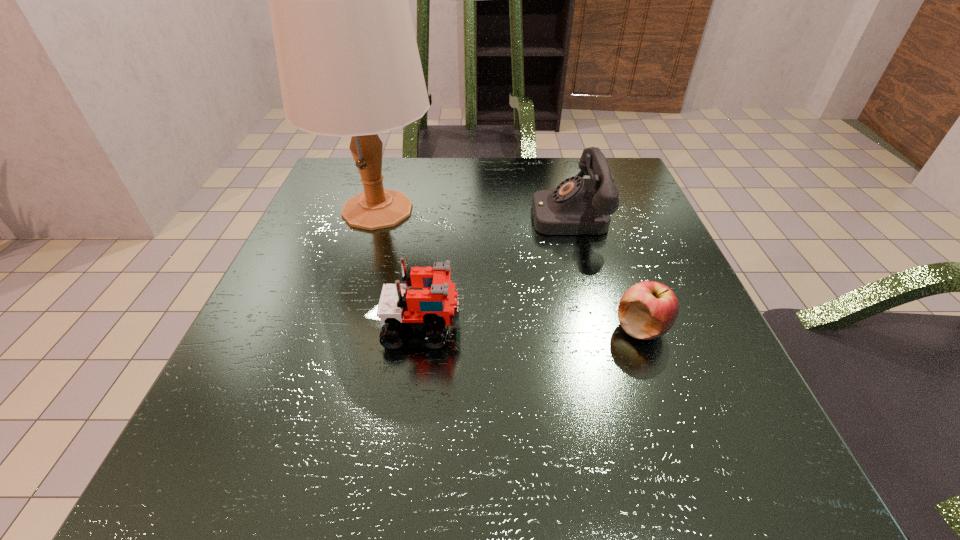
Where is `table lamp that is at the far edge`? The height and width of the screenshot is (540, 960). table lamp that is at the far edge is located at coordinates (348, 62).

This screenshot has width=960, height=540. Find the location of `telephone present at the far edge`. telephone present at the far edge is located at coordinates (578, 206).

I want to click on object that is positioned at the left edge, so click(348, 62).

Locate an element on the screen. telephone that is at the right edge is located at coordinates (578, 206).

I want to click on apple positioned at the right edge, so click(647, 310).

Find the location of `object located at the far left corner`. object located at the far left corner is located at coordinates (348, 62).

The image size is (960, 540). I want to click on object located at the far right corner, so click(x=578, y=206).

In the image, there is a desktop. At what (x,y) coordinates should I click in order to perform the action: click on vacant area at the far edge. Please return your answer as a coordinate pair (x, y). The width and height of the screenshot is (960, 540). Looking at the image, I should click on (533, 172).

Locate an element on the screen. The height and width of the screenshot is (540, 960). free space at the near edge of the desktop is located at coordinates (497, 474).

I want to click on free space at the left edge, so [x=286, y=301].